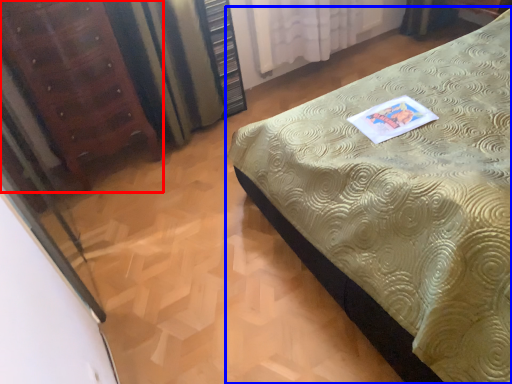
Question: Which object appears farthest to the camera in this image, furniture (highlighted by a red box) or bed (highlighted by a blue box)?

Choices:
 (A) furniture
 (B) bed

Answer: (A)